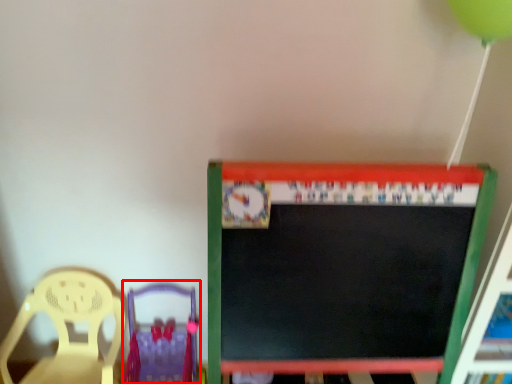
Question: Considering the relative positions of chair (annotated by the red box) and chair in the image provided, where is chair (annotated by the red box) located with respect to the staircase?

Choices:
 (A) left
 (B) right

Answer: (B)